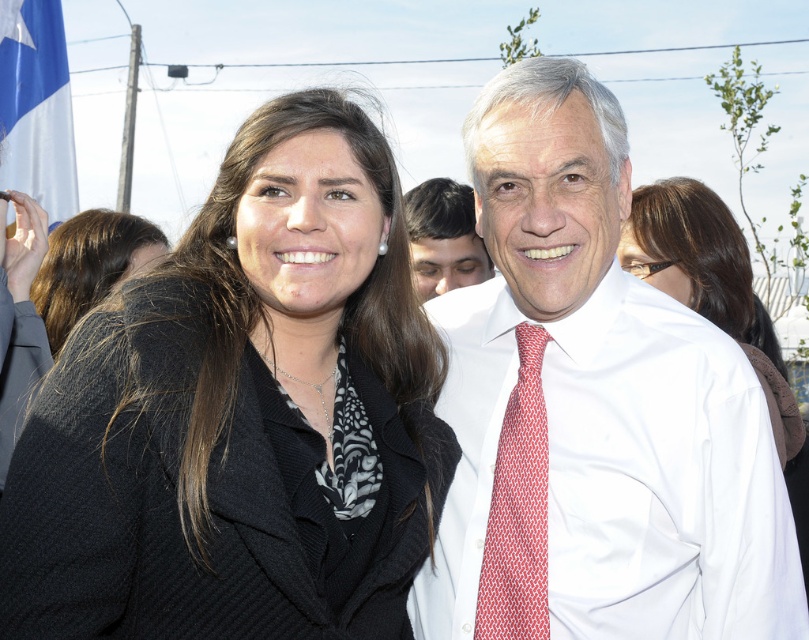
Measure the distance from red woven tie at center to black wool coat at center.

A distance of 13.73 feet exists between red woven tie at center and black wool coat at center.

This screenshot has width=809, height=640. What do you see at coordinates (519, 508) in the screenshot? I see `red woven tie at center` at bounding box center [519, 508].

This screenshot has width=809, height=640. Describe the element at coordinates (519, 508) in the screenshot. I see `red woven tie at center` at that location.

Where is `red woven tie at center`? The image size is (809, 640). red woven tie at center is located at coordinates (519, 508).

Does black wool coat at left have a smaller size compared to smooth skin face at center?

Incorrect, black wool coat at left is not smaller in size than smooth skin face at center.

Does point (291, 488) lie in front of point (447, 243)?

Yes.

Describe the element at coordinates (242, 413) in the screenshot. I see `black wool coat at left` at that location.

The width and height of the screenshot is (809, 640). What are the coordinates of `black wool coat at left` in the screenshot? It's located at (242, 413).

Which is behind, point (595, 580) or point (773, 371)?

The point (773, 371) is more distant.

Can you confirm if white smooth shirt at center is taller than black silk coat at upper center?

Yes.

You are a GUI agent. You are given a task and a screenshot of the screen. Output one action in this format:
    pyautogui.click(x=<x>, y=<y>)
    Task: Click on the white smooth shirt at center
    The width and height of the screenshot is (809, 640).
    Given the screenshot: What is the action you would take?
    pyautogui.click(x=591, y=410)